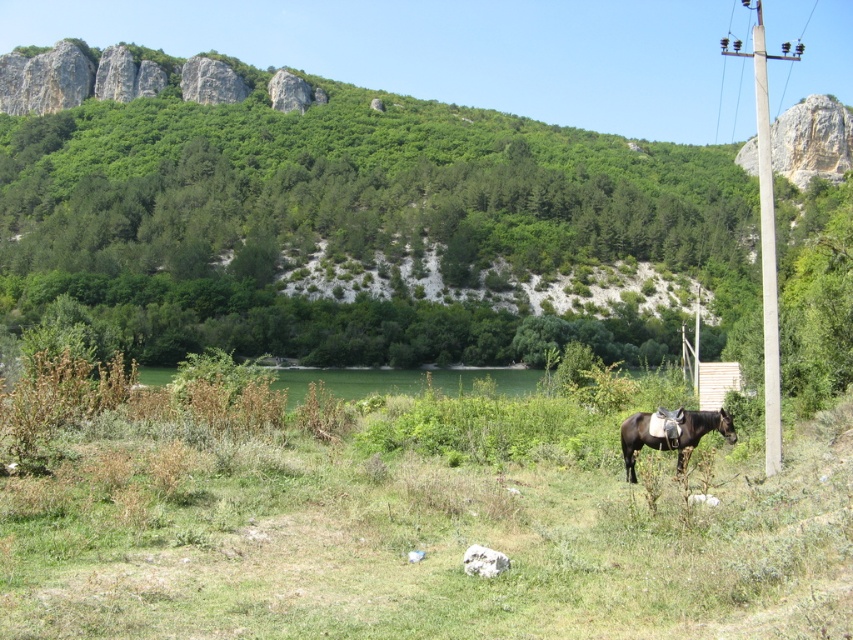
Question: Does concrete pole at right appear on the left side of brown glossy horse at center?

Choices:
 (A) yes
 (B) no

Answer: (B)

Question: Among these objects, which one is nearest to the camera?

Choices:
 (A) brown glossy horse at center
 (B) concrete pole at right
 (C) green grassy at center

Answer: (C)

Question: Which object is farther from the camera taking this photo?

Choices:
 (A) brown glossy horse at center
 (B) green grassy at center
 (C) concrete pole at right

Answer: (C)

Question: From the image, what is the correct spatial relationship of green grassy at center in relation to concrete pole at right?

Choices:
 (A) above
 (B) below

Answer: (B)

Question: Can you confirm if concrete pole at right is positioned to the left of brown glossy horse at center?

Choices:
 (A) no
 (B) yes

Answer: (A)

Question: Among these objects, which one is nearest to the camera?

Choices:
 (A) green grassy at center
 (B) brown glossy horse at center

Answer: (A)